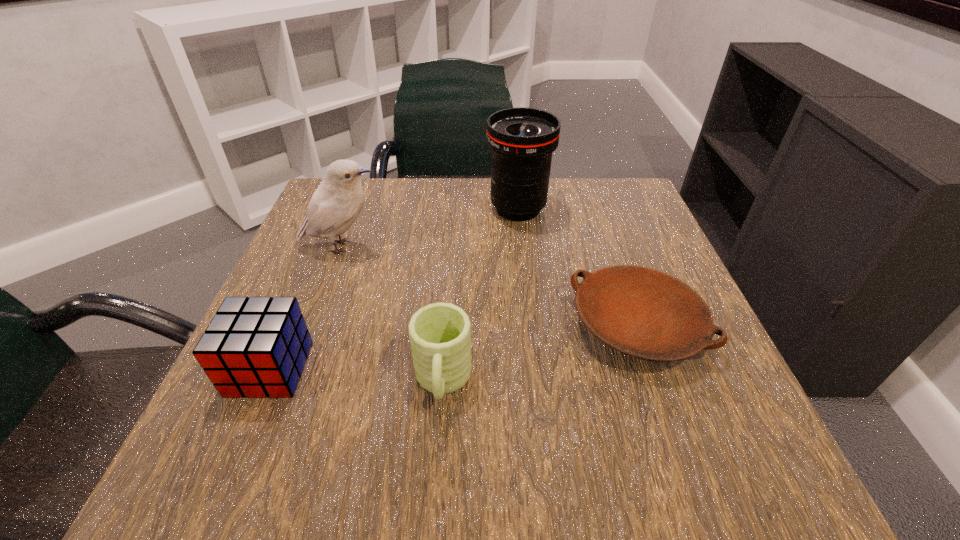
Where is `object situated at the far edge`? The width and height of the screenshot is (960, 540). object situated at the far edge is located at coordinates (521, 139).

Locate an element on the screen. The height and width of the screenshot is (540, 960). bird that is at the left edge is located at coordinates (336, 203).

Locate an element on the screen. This screenshot has width=960, height=540. cube present at the left edge is located at coordinates (256, 347).

Where is `object that is at the right edge`? The height and width of the screenshot is (540, 960). object that is at the right edge is located at coordinates (644, 313).

Locate an element on the screen. The width and height of the screenshot is (960, 540). free space at the far edge of the desktop is located at coordinates (420, 234).

The height and width of the screenshot is (540, 960). I want to click on free space at the left edge of the desktop, so click(370, 237).

Locate an element on the screen. The image size is (960, 540). vacant space at the right edge is located at coordinates (728, 379).

Where is `free space at the far left corner of the desktop`? free space at the far left corner of the desktop is located at coordinates (372, 189).

The image size is (960, 540). In the image, there is a desktop. In order to click on vacant space at the far right corner in this screenshot , I will do `click(639, 200)`.

Identify the location of vacant region at the near right corner of the desktop. (709, 454).